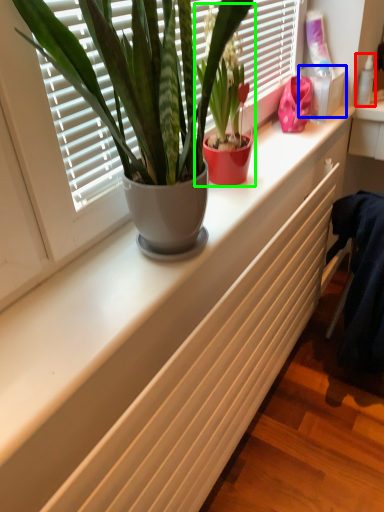
Question: Which is nearer to the toiletry (highlighted by a red box)? window box (highlighted by a blue box) or houseplant (highlighted by a green box).

Choices:
 (A) window box
 (B) houseplant

Answer: (A)